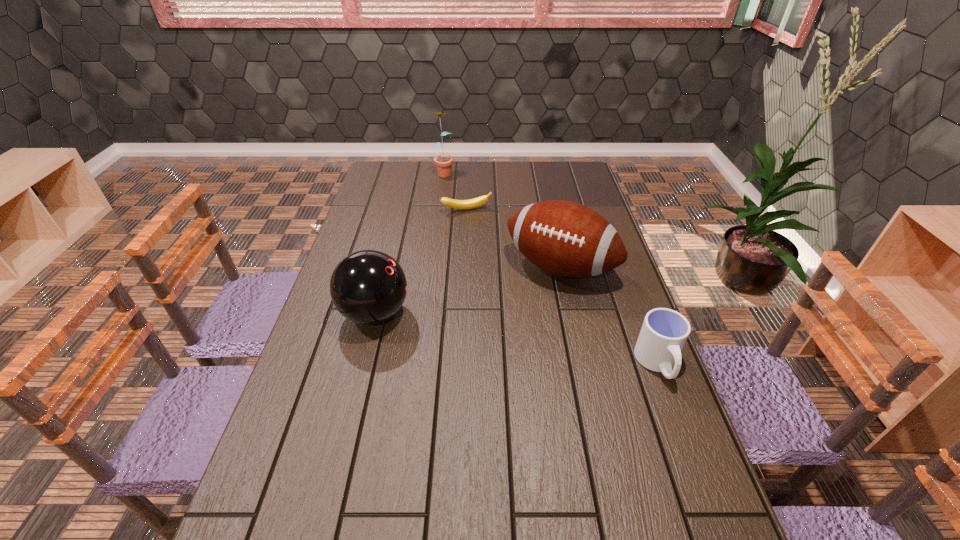
Where is `cup located in the right edge section of the desktop`? The width and height of the screenshot is (960, 540). cup located in the right edge section of the desktop is located at coordinates (664, 332).

Where is `football that is at the right edge`? This screenshot has height=540, width=960. football that is at the right edge is located at coordinates (564, 238).

The width and height of the screenshot is (960, 540). In order to click on vacant space at the far edge of the desktop in this screenshot , I will do `click(545, 168)`.

The image size is (960, 540). I want to click on vacant space at the left edge of the desktop, so click(x=357, y=224).

At what (x,y) coordinates should I click in order to perform the action: click on free point at the right edge. Please return your answer as a coordinate pair (x, y). This screenshot has height=540, width=960. Looking at the image, I should click on (586, 281).

Locate an element on the screen. vacant space at the far right corner of the desktop is located at coordinates (566, 184).

In order to click on free space at the near right corner of the desktop in this screenshot , I will do `click(660, 489)`.

Identify the location of unoccupied position between the bowling ball and the cup. (516, 339).

Locate an element on the screen. Image resolution: width=960 pixels, height=540 pixels. vacant region between the cup and the banana is located at coordinates (563, 287).

Identify the location of empty space between the sunflower and the shortest object. pos(455,191).